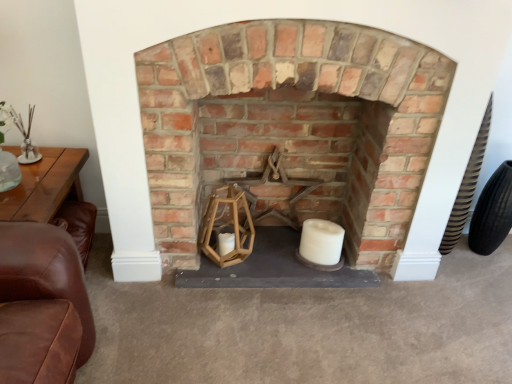
This screenshot has height=384, width=512. Find the location of `free space above white matte candle at center (from a real-world perspective)`. free space above white matte candle at center (from a real-world perspective) is located at coordinates (323, 228).